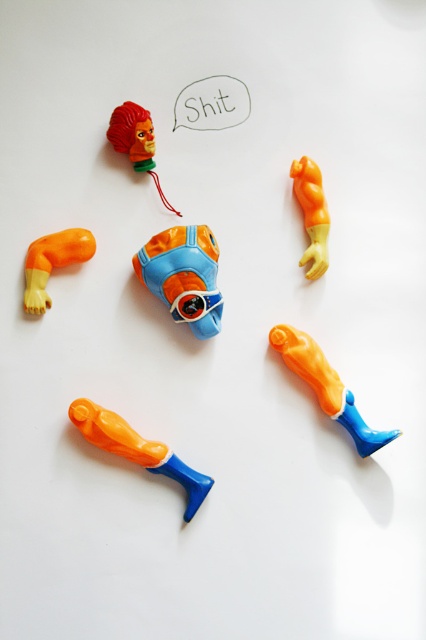
Can you confirm if matte plastic toy head at center is bigger than orange matte toy at lower left?

No.

Is point (135, 268) in front of point (163, 461)?

No.

Identify the location of matte plastic toy head at center. (184, 275).

Is orange matte toy at lower left shorter than orange matte plastic arm at upper center?

Yes.

You are a GUI agent. You are given a task and a screenshot of the screen. Output one action in this format:
    pyautogui.click(x=<x>, y=<y>)
    Task: Click on the orange matte toy at lower left
    This screenshot has width=426, height=640.
    Given the screenshot: What is the action you would take?
    pyautogui.click(x=138, y=449)

Does orange matte toy at lower left appear under orange matte plastic arm at upper left?

Indeed, orange matte toy at lower left is positioned under orange matte plastic arm at upper left.

How much distance is there between orange matte toy at lower left and orange matte plastic arm at upper left?

They are 12.07 inches apart.

This screenshot has height=640, width=426. What do you see at coordinates (138, 449) in the screenshot?
I see `orange matte toy at lower left` at bounding box center [138, 449].

Where is `orange matte toy at lower left`? The image size is (426, 640). orange matte toy at lower left is located at coordinates (138, 449).